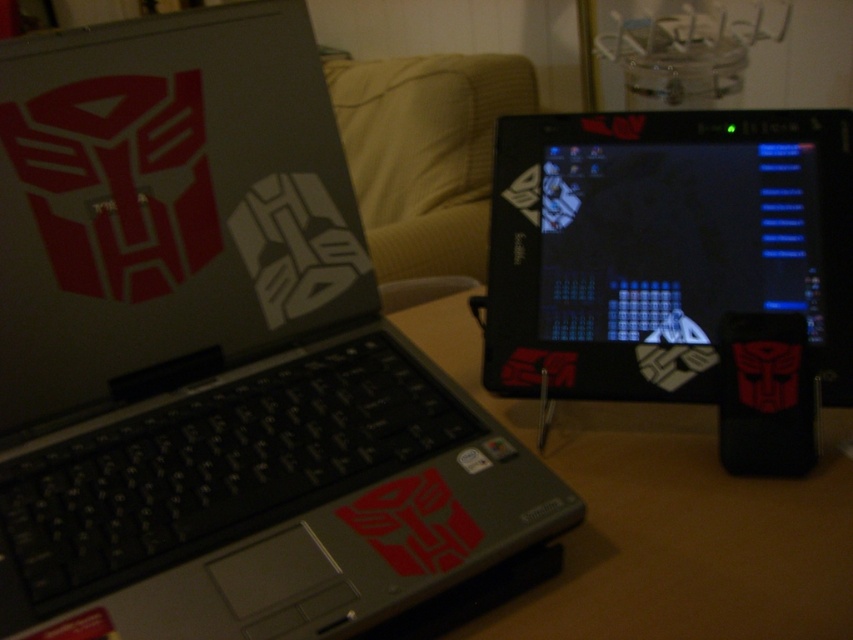
Is matte black screen at center bigger than brown wooden table at center?

No.

Is point (746, 220) farther from camera compared to point (799, 508)?

That is True.

Who is more forward, (811, 150) or (473, 332)?

Point (811, 150) is more forward.

You are a GUI agent. You are given a task and a screenshot of the screen. Output one action in this format:
    pyautogui.click(x=<x>, y=<y>)
    Task: Click on the matte black screen at center
    This screenshot has width=853, height=640.
    Given the screenshot: What is the action you would take?
    pyautogui.click(x=664, y=248)

Looking at this image, does matte black screen at center have a larger size compared to matte black laptop at center?

No, matte black screen at center is not bigger than matte black laptop at center.

Is point (676, 369) farther from viewer compared to point (401, 161)?

No, it is in front of (401, 161).

Between point (589, 134) and point (514, 92), which one is positioned behind?

Positioned behind is point (514, 92).

Find the location of a particular element. The image size is (853, 640). matte black screen at center is located at coordinates (664, 248).

Is point (283, 467) in front of point (786, 124)?

That is True.

The height and width of the screenshot is (640, 853). Describe the element at coordinates (218, 355) in the screenshot. I see `matte black laptop at left` at that location.

Is point (144, 32) more distant than point (628, 115)?

No.

At what (x,y) coordinates should I click in order to perform the action: click on matte black laptop at left. Please return your answer as a coordinate pair (x, y). Image resolution: width=853 pixels, height=640 pixels. Looking at the image, I should click on (218, 355).